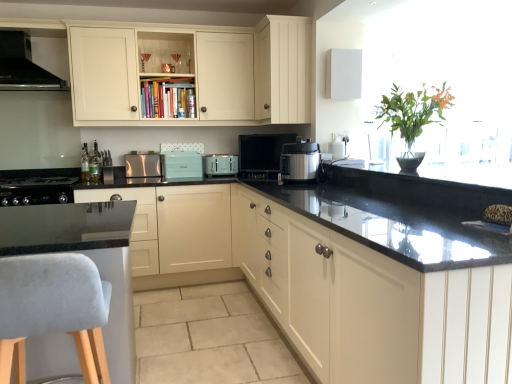
Question: Could you tell me if metallic silver toaster at center, acting as the third appliance starting from the left, is turned towards cream matte cabinet at upper center, the third cabinetry when ordered from bottom to top?

Choices:
 (A) yes
 (B) no

Answer: (B)

Question: From the image's perspective, would you say metallic silver toaster at center, which is counted as the first appliance, starting from the right, is positioned over cream matte cabinet at upper center, placed as the 1th cabinetry when sorted from top to bottom?

Choices:
 (A) no
 (B) yes

Answer: (A)

Question: Can you confirm if metallic silver toaster at center, which is counted as the first appliance, starting from the right, is taller than cream matte cabinet at upper center, the third cabinetry when ordered from bottom to top?

Choices:
 (A) no
 (B) yes

Answer: (A)

Question: Considering the relative sizes of metallic silver toaster at center, which is counted as the first appliance, starting from the right, and cream matte cabinet at upper center, the third cabinetry when ordered from bottom to top, in the image provided, is metallic silver toaster at center, which is counted as the first appliance, starting from the right, thinner than cream matte cabinet at upper center, the third cabinetry when ordered from bottom to top,?

Choices:
 (A) yes
 (B) no

Answer: (A)

Question: Is metallic silver toaster at center, acting as the third appliance starting from the left, next to cream matte cabinet at upper center, placed as the 1th cabinetry when sorted from top to bottom, and touching it?

Choices:
 (A) no
 (B) yes

Answer: (A)

Question: Based on their sizes in the image, would you say matte cream cabinet at upper center, the 2th cabinetry in the bottom-to-top sequence, is bigger or smaller than clear glass bottle at left, marked as the 2th bottle in a back-to-front arrangement?

Choices:
 (A) small
 (B) big

Answer: (B)

Question: From the image's perspective, is matte cream cabinet at upper center, the 2th cabinetry in the bottom-to-top sequence, located above or below clear glass bottle at left, acting as the first bottle starting from the front?

Choices:
 (A) above
 (B) below

Answer: (A)

Question: Is matte cream cabinet at upper center, which is the second cabinetry in top-to-bottom order, taller or shorter than clear glass bottle at left, marked as the 2th bottle in a back-to-front arrangement?

Choices:
 (A) short
 (B) tall

Answer: (B)

Question: Is matte cream cabinet at upper center, which is the second cabinetry in top-to-bottom order, in front of or behind clear glass bottle at left, acting as the first bottle starting from the front, in the image?

Choices:
 (A) front
 (B) behind

Answer: (A)

Question: Considering the positions of point (146, 173) and point (263, 69), is point (146, 173) closer or farther from the camera than point (263, 69)?

Choices:
 (A) farther
 (B) closer

Answer: (A)

Question: Looking at their shapes, would you say satin silver toaster at center, the third kitchen appliance from the right, is wider or thinner than cream matte cabinet at upper center, placed as the 1th cabinetry when sorted from top to bottom?

Choices:
 (A) thin
 (B) wide

Answer: (A)

Question: From the image's perspective, relative to cream matte cabinet at upper center, placed as the 1th cabinetry when sorted from top to bottom, is satin silver toaster at center, the third kitchen appliance from the right, above or below?

Choices:
 (A) above
 (B) below

Answer: (B)

Question: In terms of height, does satin silver toaster at center, which is counted as the second kitchen appliance, starting from the top, look taller or shorter compared to cream matte cabinet at upper center, the third cabinetry when ordered from bottom to top?

Choices:
 (A) tall
 (B) short

Answer: (B)

Question: Relative to cream matte cabinet at upper center, the third cabinetry when ordered from bottom to top, is teal matte toaster at center, which ranks as the 2th appliance in left-to-right order, in front or behind?

Choices:
 (A) behind
 (B) front

Answer: (A)

Question: Considering the positions of teal matte toaster at center, which is counted as the 2th appliance, starting from the right, and cream matte cabinet at upper center, the third cabinetry when ordered from bottom to top, in the image, is teal matte toaster at center, which is counted as the 2th appliance, starting from the right, bigger or smaller than cream matte cabinet at upper center, the third cabinetry when ordered from bottom to top,?

Choices:
 (A) small
 (B) big

Answer: (A)